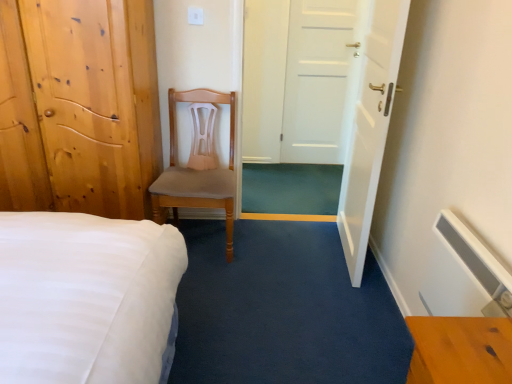
Where is `vacant space in light brown wood chair at center (from a real-world perspective)`? vacant space in light brown wood chair at center (from a real-world perspective) is located at coordinates (206, 240).